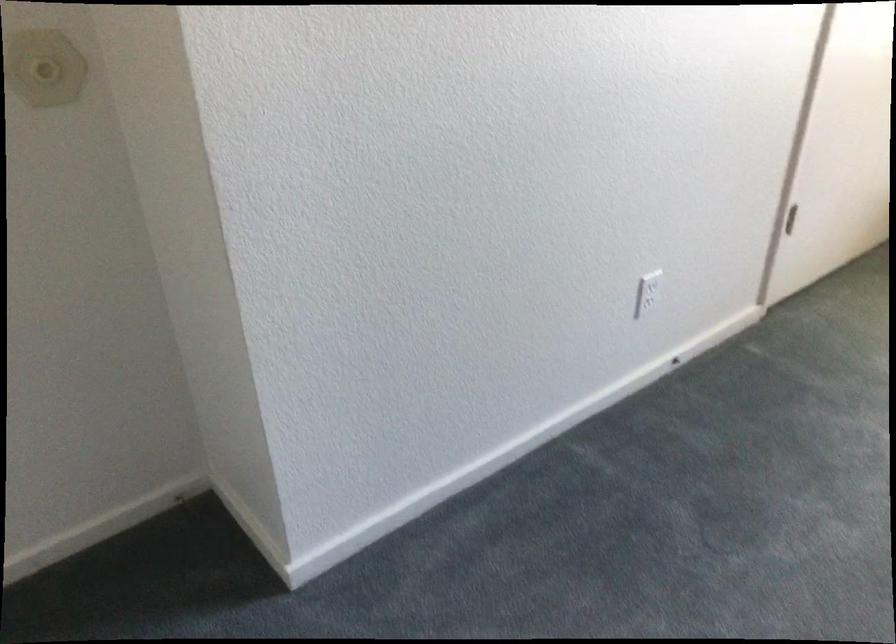
At what (x,y) coordinates should I click in order to perform the action: click on recessed door handle. Please return your answer as a coordinate pair (x, y). The image size is (896, 644). Looking at the image, I should click on (790, 219).